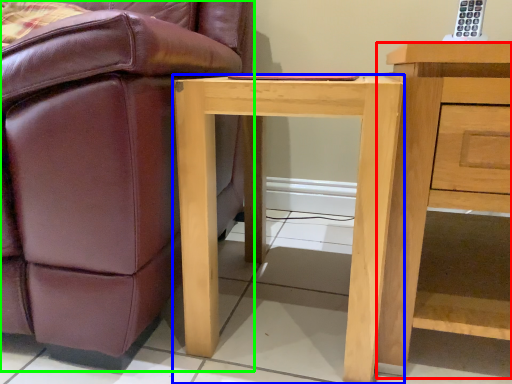
Question: Based on their relative distances, which object is nearer to nightstand (highlighted by a red box)? Choose from desk (highlighted by a blue box) and chair (highlighted by a green box).

Choices:
 (A) desk
 (B) chair

Answer: (A)